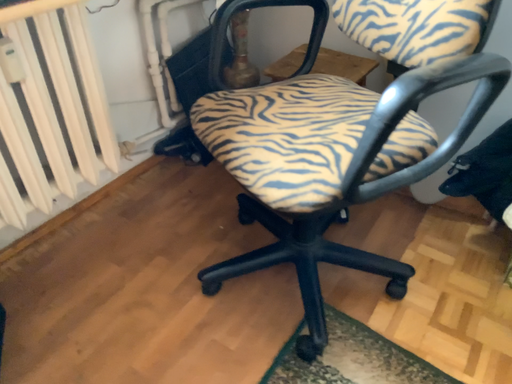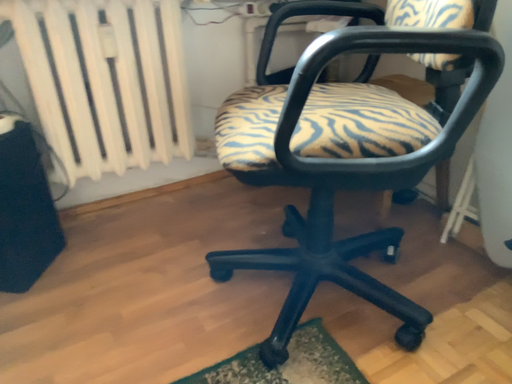
Question: Which way did the camera rotate in the video?

Choices:
 (A) rotated left
 (B) rotated right

Answer: (A)